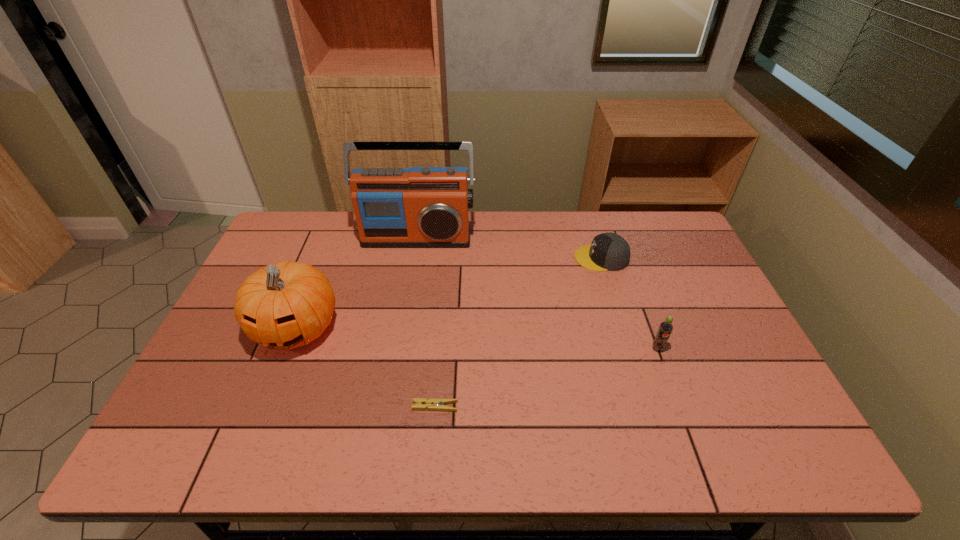
You are a GUI agent. You are given a task and a screenshot of the screen. Output one action in this format:
    pyautogui.click(x=<x>, y=<y>)
    Task: Click on the object that ranks as the third closest to the third shortest object
    The image size is (960, 540).
    Given the screenshot: What is the action you would take?
    pyautogui.click(x=419, y=207)

You are a GUI agent. You are given a task and a screenshot of the screen. Output one action in this format:
    pyautogui.click(x=<x>, y=<y>)
    Task: Click on the object that is the second closest one to the third shortest object
    The image size is (960, 540).
    Given the screenshot: What is the action you would take?
    [x=419, y=403]

What are the coordinates of `free space that satisfies the following two spatial constraints: 1. on the front-facing side of the cap; 2. on the front-facing side of the pumpkin` in the screenshot? It's located at (623, 328).

Find the location of a particular element. free space that satisfies the following two spatial constraints: 1. on the front-facing side of the clothespin; 2. on the left side of the tallest object is located at coordinates (388, 407).